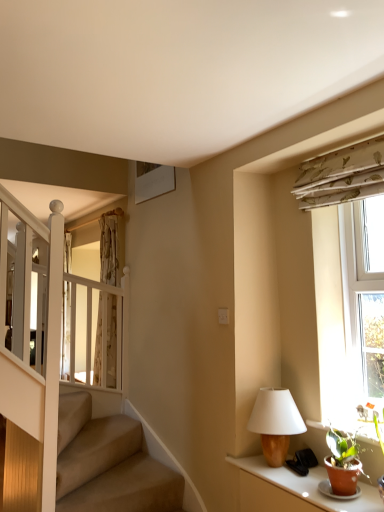
This screenshot has height=512, width=384. In order to click on free space in front of wooden table lamp at right in this screenshot , I will do `click(304, 483)`.